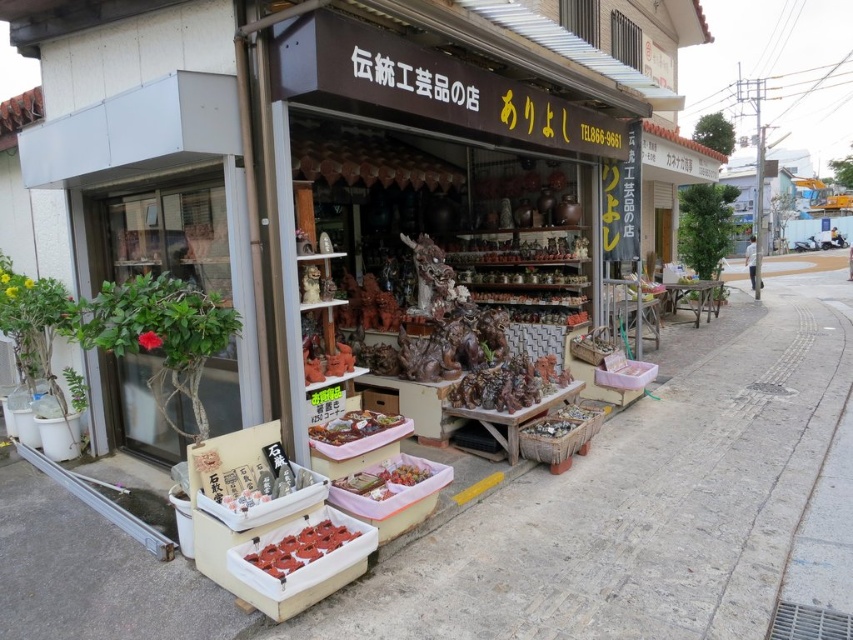
You are a customer in the shop and want to buy both the matte red donuts at lower center and the shiny brown food at center. Which item takes up more space horizontally on the shelf?

The shiny brown food at center has a greater width than the matte red donuts at lower center, so it takes up more horizontal space on the shelf.

You are a customer entering the shop and notice the smooth concrete pavement at lower center and the green leafy plant at left. Which object is nearer to you as you stand at the entrance?

The smooth concrete pavement at lower center is closer to the viewer than the green leafy plant at left, so the smooth concrete pavement at lower center is nearer to you as you stand at the entrance.

You are a customer in the shop and want to buy both the matte red donuts at lower center and the shiny brown food at center. Which item is shorter?

The matte red donuts at lower center is not as tall as the shiny brown food at center, so the matte red donuts at lower center is shorter.